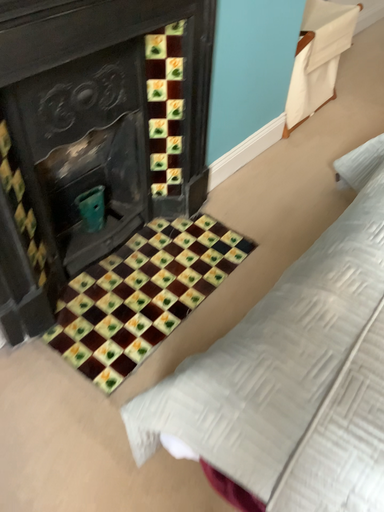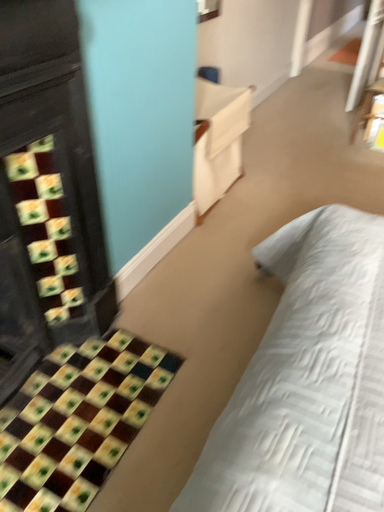
Question: How did the camera likely rotate when shooting the video?

Choices:
 (A) rotated left
 (B) rotated right

Answer: (B)